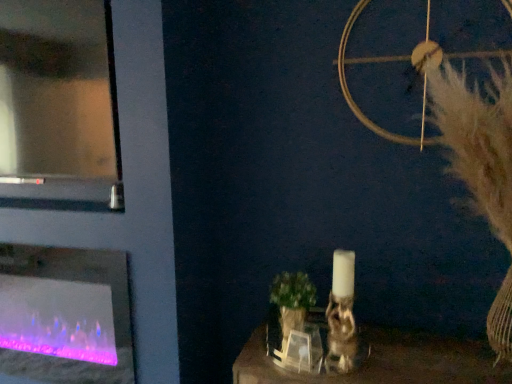
Question: In terms of size, does translucent glass fireplace at left appear bigger or smaller than white fluffy feather at upper right?

Choices:
 (A) big
 (B) small

Answer: (B)

Question: From a real-world perspective, relative to white fluffy feather at upper right, is translucent glass fireplace at left vertically above or below?

Choices:
 (A) below
 (B) above

Answer: (A)

Question: Which object is positioned farthest from the transparent glass door at upper left?

Choices:
 (A) white fluffy feather at upper right
 (B) translucent glass fireplace at left

Answer: (A)

Question: Estimate the real-world distances between objects in this image. Which object is closer to the white fluffy feather at upper right?

Choices:
 (A) translucent glass fireplace at left
 (B) transparent glass door at upper left

Answer: (B)